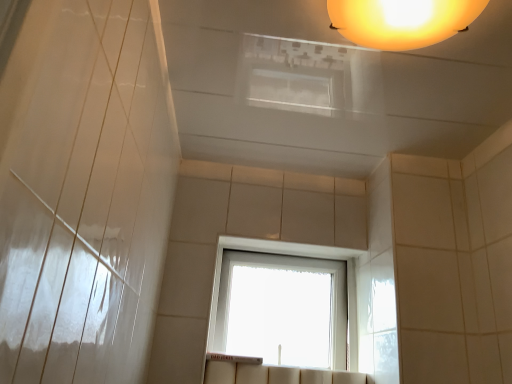
Question: Is matte orange globe at upper center spatially inside transparent glass window at center, or outside of it?

Choices:
 (A) outside
 (B) inside

Answer: (A)

Question: From their relative heights in the image, would you say matte orange globe at upper center is taller or shorter than transparent glass window at center?

Choices:
 (A) tall
 (B) short

Answer: (B)

Question: From the image's perspective, is matte orange globe at upper center above or below transparent glass window at center?

Choices:
 (A) above
 (B) below

Answer: (A)

Question: Is transparent glass window at center to the left or to the right of matte orange globe at upper center in the image?

Choices:
 (A) left
 (B) right

Answer: (A)

Question: Based on their sizes in the image, would you say transparent glass window at center is bigger or smaller than matte orange globe at upper center?

Choices:
 (A) big
 (B) small

Answer: (A)

Question: Choose the correct answer: Is transparent glass window at center inside matte orange globe at upper center or outside it?

Choices:
 (A) inside
 (B) outside

Answer: (B)

Question: From the image's perspective, is transparent glass window at center located above or below matte orange globe at upper center?

Choices:
 (A) above
 (B) below

Answer: (B)